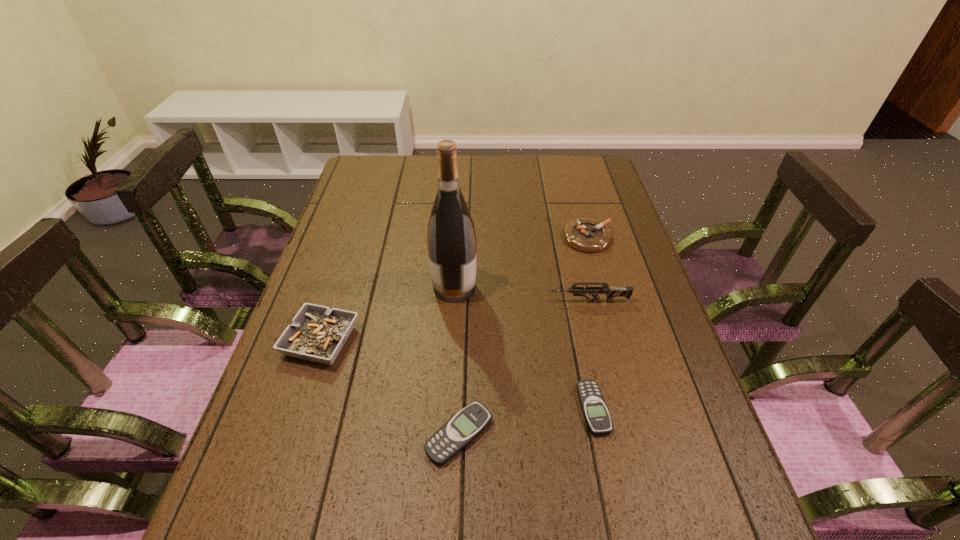
Identify the location of free point that keeps the beepers evenly spaced on the left. The image size is (960, 540). (312, 463).